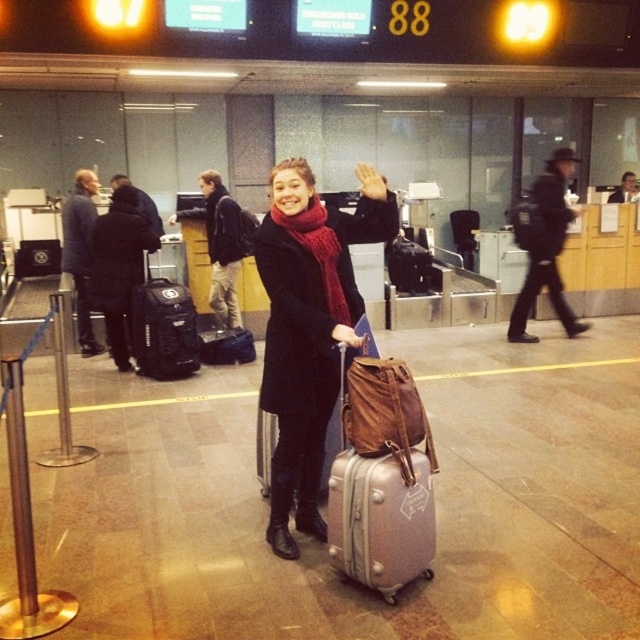
Measure the distance between silver metallic suitcase at center and black fabric backpack at center-left.

3.13 meters

Is silver metallic suitcase at center to the left of black fabric backpack at center-left from the viewer's perspective?

In fact, silver metallic suitcase at center is to the right of black fabric backpack at center-left.

Where is `silver metallic suitcase at center`? The width and height of the screenshot is (640, 640). silver metallic suitcase at center is located at coordinates (381, 477).

Between dark blue jacket at left and smooth black jacket at center, which one is positioned higher?

smooth black jacket at center is above.

The width and height of the screenshot is (640, 640). Find the location of `dark blue jacket at left`. dark blue jacket at left is located at coordinates (81, 252).

Who is positioned more to the left, leather backpack at center or black fabric backpack at left?

From the viewer's perspective, black fabric backpack at left appears more on the left side.

Which is above, leather backpack at center or black fabric backpack at left?

black fabric backpack at left is above.

Is point (422, 433) more distant than point (104, 227)?

No, (422, 433) is in front of (104, 227).

Where is `leather backpack at center`? The image size is (640, 640). leather backpack at center is located at coordinates (384, 412).